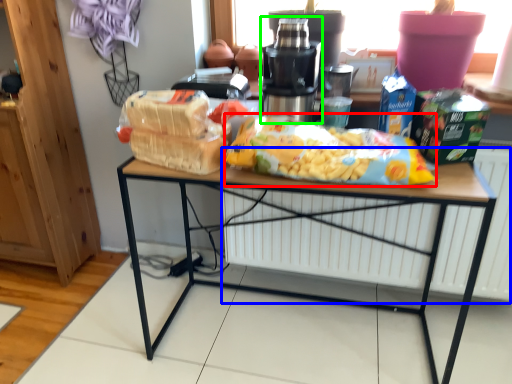
Question: Based on their relative distances, which object is farther from cereal (highlighted by a red box)? Choose from radiator (highlighted by a blue box) and tableware (highlighted by a green box).

Choices:
 (A) radiator
 (B) tableware

Answer: (A)